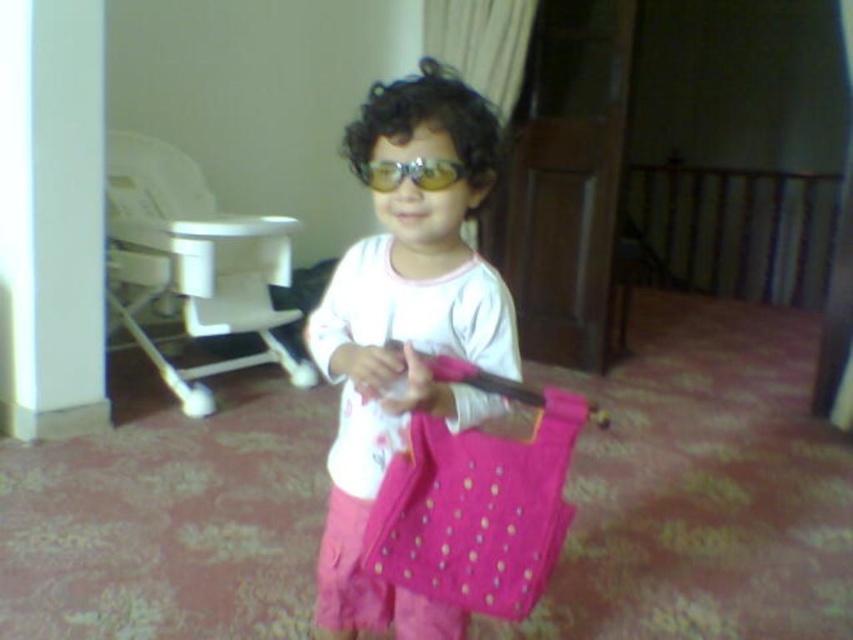
Does matte pink fabric at center appear under yellow reflective lenses at center?

Indeed, matte pink fabric at center is positioned under yellow reflective lenses at center.

Who is lower down, matte pink fabric at center or yellow reflective lenses at center?

Positioned lower is matte pink fabric at center.

Find the location of a particular element. The image size is (853, 640). matte pink fabric at center is located at coordinates (405, 332).